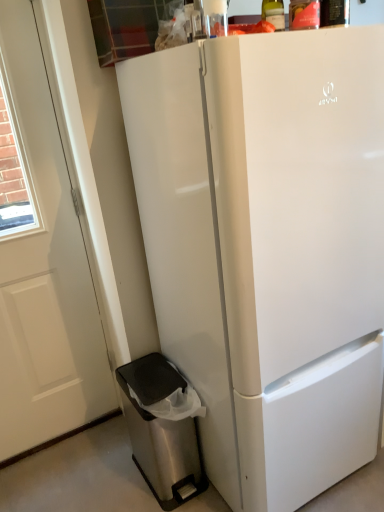
Question: Is translucent glass bottle at upper center facing away from stainless steel trash can at lower left?

Choices:
 (A) yes
 (B) no

Answer: (B)

Question: Is translucent glass bottle at upper center aimed at stainless steel trash can at lower left?

Choices:
 (A) no
 (B) yes

Answer: (A)

Question: Is translucent glass bottle at upper center smaller than stainless steel trash can at lower left?

Choices:
 (A) no
 (B) yes

Answer: (B)

Question: Can you confirm if translucent glass bottle at upper center is positioned to the left of stainless steel trash can at lower left?

Choices:
 (A) no
 (B) yes

Answer: (A)

Question: From the image's perspective, is translucent glass bottle at upper center below stainless steel trash can at lower left?

Choices:
 (A) yes
 (B) no

Answer: (B)

Question: Is translucent glass bottle at upper center surrounding stainless steel trash can at lower left?

Choices:
 (A) no
 (B) yes

Answer: (A)

Question: Is white glossy refrigerator at center outside white matte door at left?

Choices:
 (A) yes
 (B) no

Answer: (A)

Question: Is white glossy refrigerator at center taller than white matte door at left?

Choices:
 (A) yes
 (B) no

Answer: (B)

Question: Is white matte door at left at the back of white glossy refrigerator at center?

Choices:
 (A) no
 (B) yes

Answer: (A)

Question: From the image's perspective, would you say white glossy refrigerator at center is shown under white matte door at left?

Choices:
 (A) yes
 (B) no

Answer: (A)

Question: From a real-world perspective, is white glossy refrigerator at center located beneath white matte door at left?

Choices:
 (A) yes
 (B) no

Answer: (A)

Question: Does white glossy refrigerator at center have a smaller size compared to white matte door at left?

Choices:
 (A) yes
 (B) no

Answer: (B)

Question: From a real-world perspective, is white glossy refrigerator at center physically below stainless steel trash can at lower left?

Choices:
 (A) no
 (B) yes

Answer: (A)